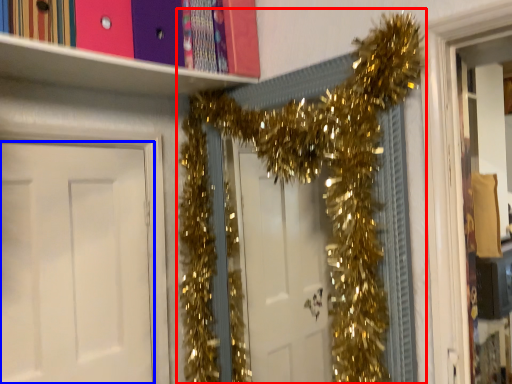
Question: Which object is further to the camera taking this photo, christmas decoration (highlighted by a red box) or door (highlighted by a blue box)?

Choices:
 (A) christmas decoration
 (B) door

Answer: (B)